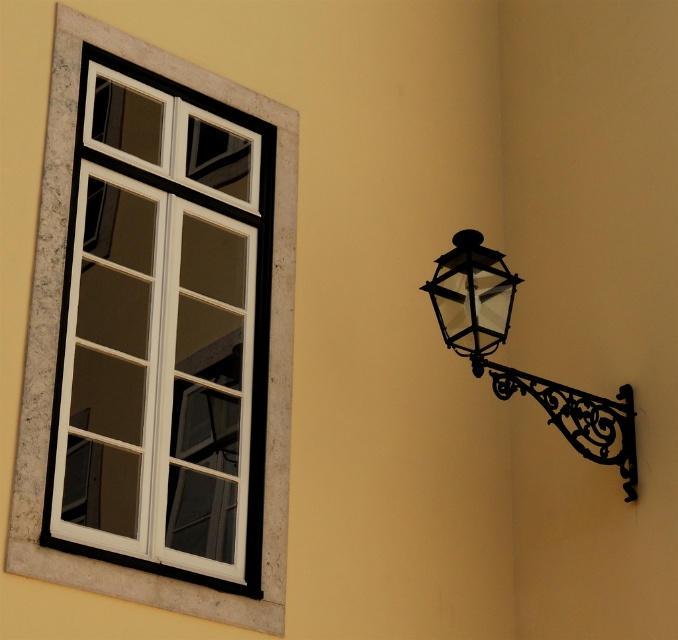
Question: Can you confirm if white matte window at left is wider than black wrought iron streetlamp at right?

Choices:
 (A) yes
 (B) no

Answer: (B)

Question: Among these objects, which one is farthest from the camera?

Choices:
 (A) white matte window at left
 (B) black wrought iron streetlamp at right
 (C) black wrought iron lantern at right

Answer: (A)

Question: Considering the real-world distances, which object is closest to the white matte window at left?

Choices:
 (A) black wrought iron lantern at right
 (B) black wrought iron streetlamp at right

Answer: (A)

Question: Which object is positioned closest to the white matte window at left?

Choices:
 (A) black wrought iron lantern at right
 (B) black wrought iron streetlamp at right

Answer: (A)

Question: In this image, where is white matte window at left located relative to black wrought iron lantern at right?

Choices:
 (A) below
 (B) above

Answer: (B)

Question: Does white matte window at left have a larger size compared to black wrought iron lantern at right?

Choices:
 (A) yes
 (B) no

Answer: (B)